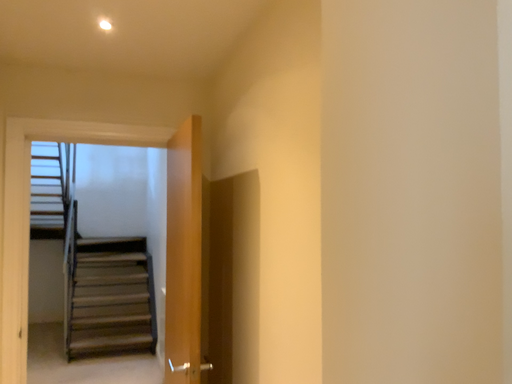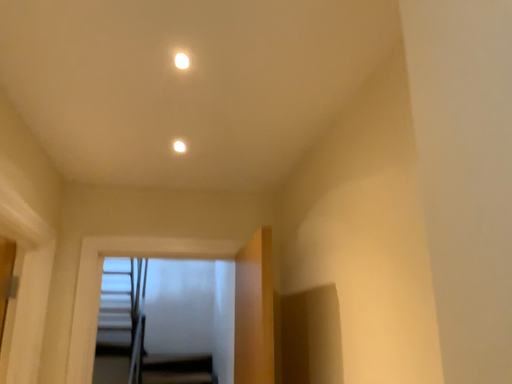
Question: Which way did the camera rotate in the video?

Choices:
 (A) rotated left
 (B) rotated right

Answer: (A)